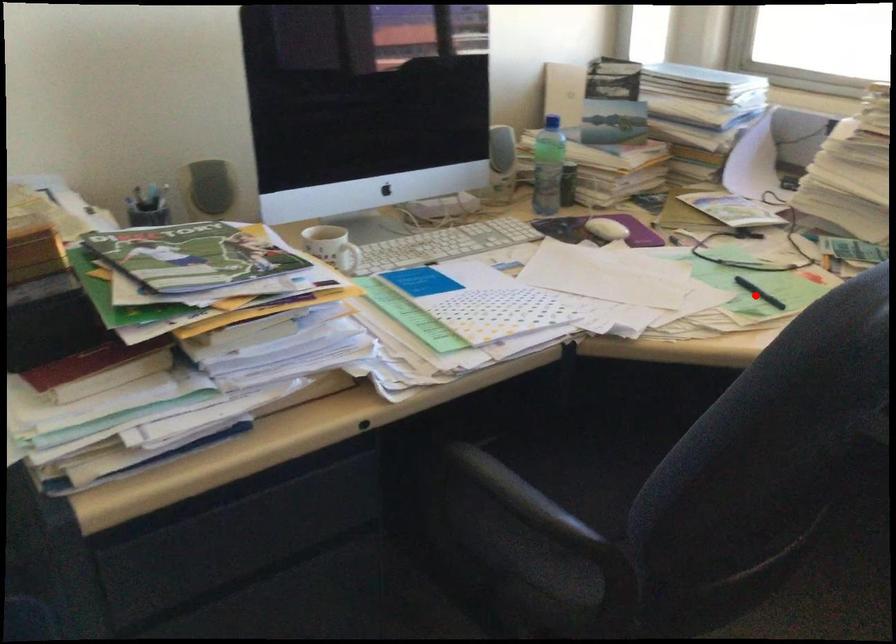
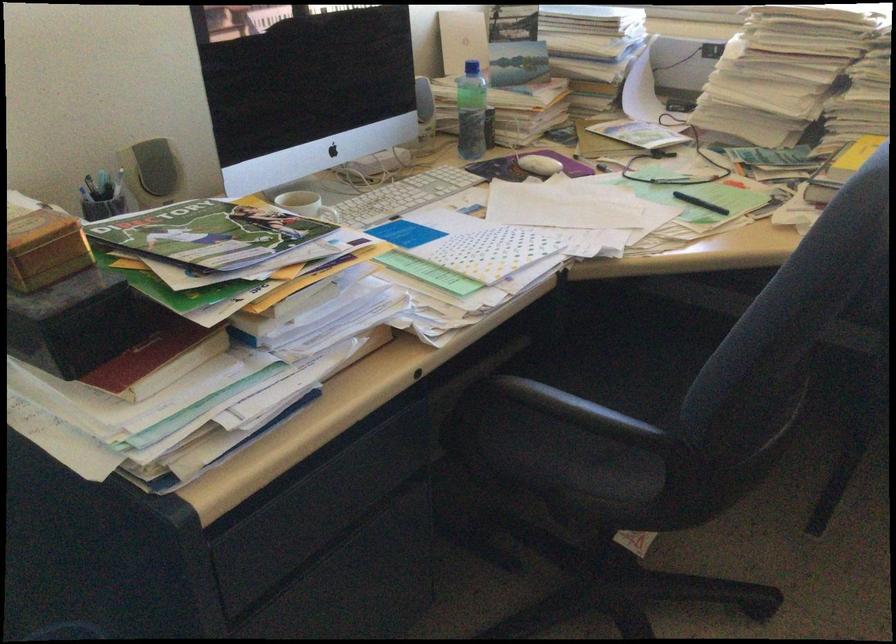
Question: I am providing you with two images of the same scene from different viewpoints. Image1 has a red point marked. In image2, the corresponding 3D location appears at what relative position? Reply with the corresponding letter.

Choices:
 (A) Closer
 (B) Farther

Answer: (B)